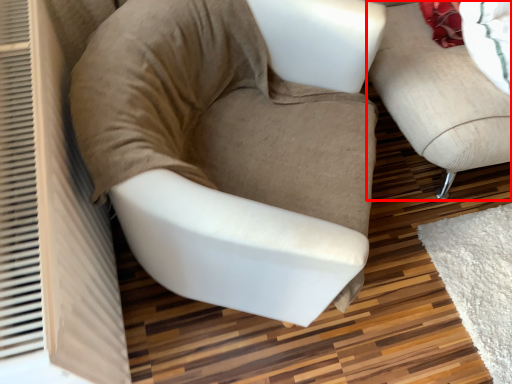
Question: Observing the image, what is the correct spatial positioning of studio couch (annotated by the red box) in reference to chair?

Choices:
 (A) right
 (B) left

Answer: (A)